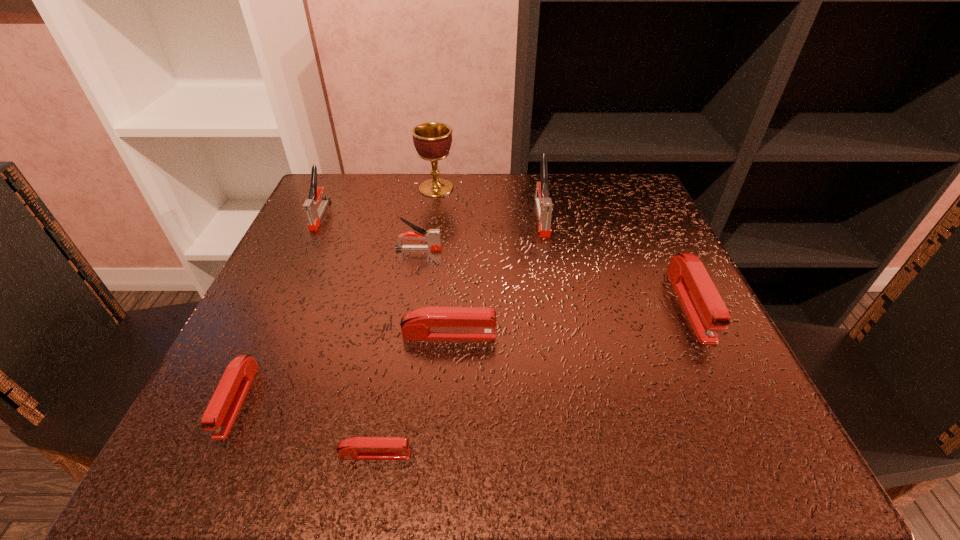
Image resolution: width=960 pixels, height=540 pixels. Find the location of `vacant space in between the rightmost gray stapler and the rightmost object`. vacant space in between the rightmost gray stapler and the rightmost object is located at coordinates [x=615, y=260].

This screenshot has height=540, width=960. Identify the location of free space between the leftmost red stapler and the shortest object. (306, 427).

Where is `free space between the sixth shortest object and the nearest gray stapler`? free space between the sixth shortest object and the nearest gray stapler is located at coordinates (370, 232).

Locate which object is the fifth closest to the farthest object. Please provide its 2D coordinates. Your answer should be formatted as a tuple, i.e. [(x, y)], where the tuple contains the x and y coordinates of a point satisfying the conditions above.

[(703, 305)]

What are the coordinates of `object that is the fourth closest to the tallest stapler` in the screenshot? It's located at (428, 323).

This screenshot has height=540, width=960. I want to click on stapler object that ranks as the fourth closest to the smallest red stapler, so click(x=703, y=305).

Locate which stapler is the third closest to the shortest object. Please provide its 2D coordinates. Your answer should be formatted as a tuple, i.e. [(x, y)], where the tuple contains the x and y coordinates of a point satisfying the conditions above.

[(432, 236)]

Identify the location of gray stapler that can be found as the second closest to the rightmost red stapler. (432, 236).

Where is `gray stapler object that ranks as the second closest to the nearest gray stapler`? This screenshot has height=540, width=960. gray stapler object that ranks as the second closest to the nearest gray stapler is located at coordinates (544, 205).

I want to click on the closest red stapler to the golden chalice, so click(428, 323).